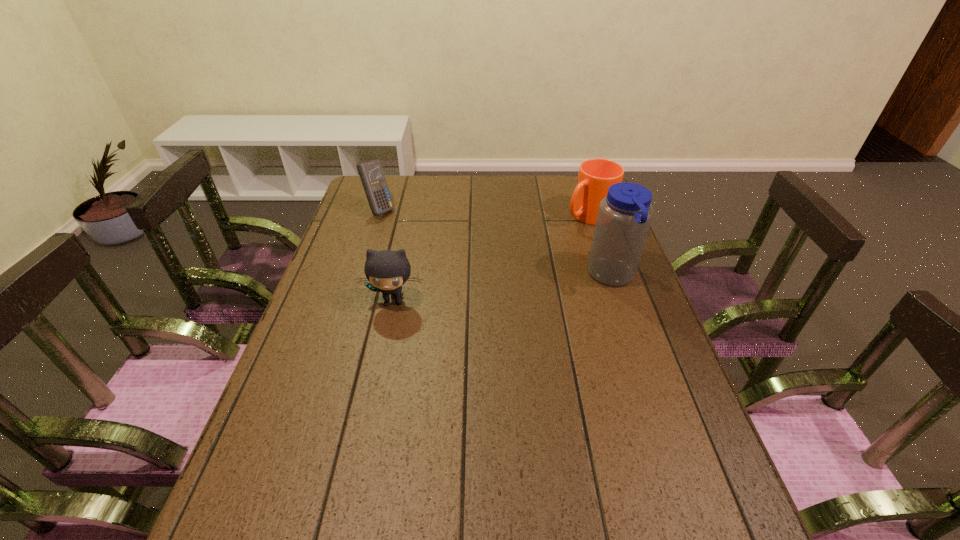
The width and height of the screenshot is (960, 540). Find the location of `vacant space on the desktop that is between the kitten and the water bottle and is positioned on the front-facing side of the calculator`. vacant space on the desktop that is between the kitten and the water bottle and is positioned on the front-facing side of the calculator is located at coordinates (519, 286).

You are a GUI agent. You are given a task and a screenshot of the screen. Output one action in this format:
    pyautogui.click(x=<x>, y=<y>)
    Task: Click on the vacant space on the desktop that is between the kitten and the water bottle and is positioned on the handle side of the mug
    The height and width of the screenshot is (540, 960).
    Given the screenshot: What is the action you would take?
    pyautogui.click(x=474, y=292)